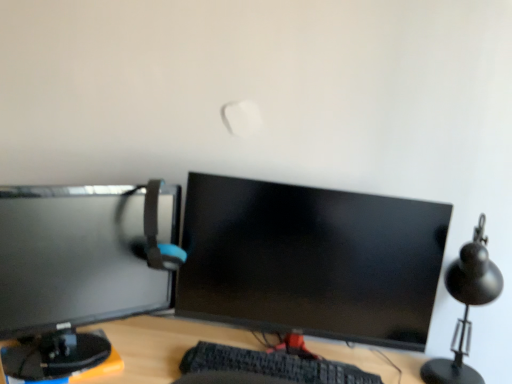
I want to click on free space above black textured keyboard at center (from a real-world perspective), so click(x=271, y=361).